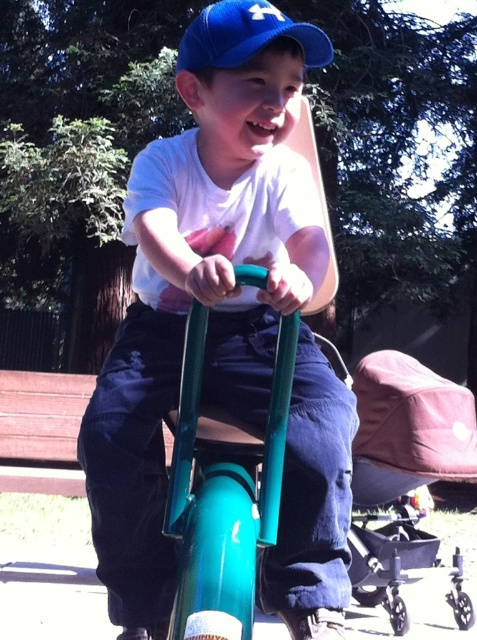
Can you confirm if matte blue cap at upper center is shorter than black plastic stroller at lower right?

In fact, matte blue cap at upper center may be taller than black plastic stroller at lower right.

Which is in front, point (311, 387) or point (376, 540)?

Point (311, 387) is more forward.

At what (x,y) coordinates should I click in order to perform the action: click on matte blue cap at upper center. Please return your answer as a coordinate pair (x, y). Looking at the image, I should click on (201, 280).

Who is more forward, [470,605] or [330,40]?

Point [330,40] is more forward.

Who is more forward, (460, 573) or (263, 36)?

Point (263, 36)

I want to click on black plastic stroller at lower right, so click(x=401, y=561).

Is matte blue cap at upper center in front of blue fabric cap at upper center?

Yes, it is in front of blue fabric cap at upper center.

Describe the element at coordinates (201, 280) in the screenshot. I see `matte blue cap at upper center` at that location.

Identify the location of matte blue cap at upper center. Image resolution: width=477 pixels, height=640 pixels. (201, 280).